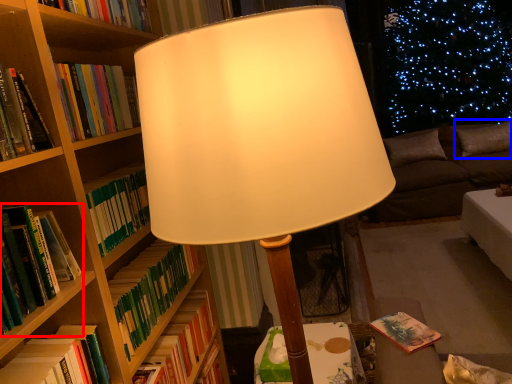
Question: Which point is closer to the camera, book (highlighted by a red box) or pillow (highlighted by a blue box)?

Choices:
 (A) book
 (B) pillow

Answer: (A)